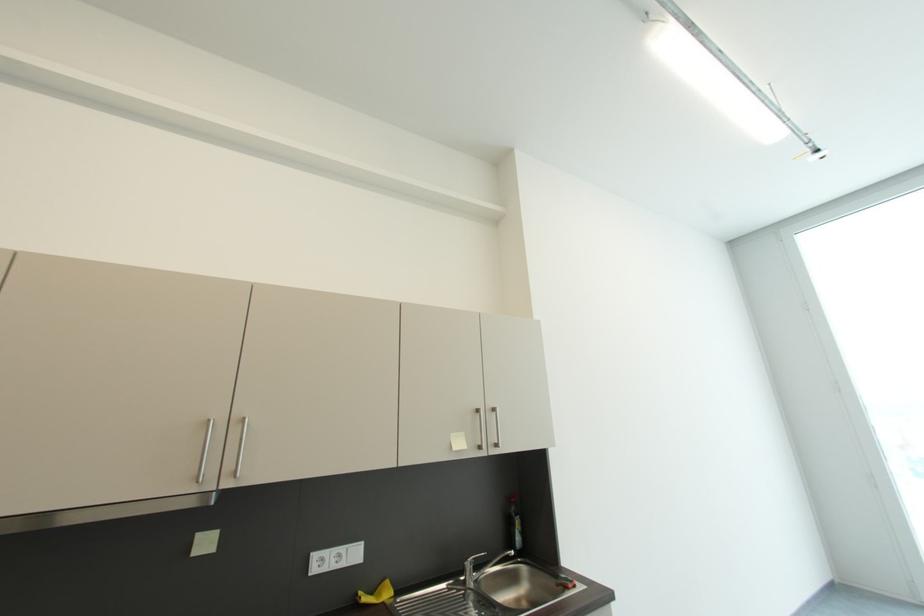
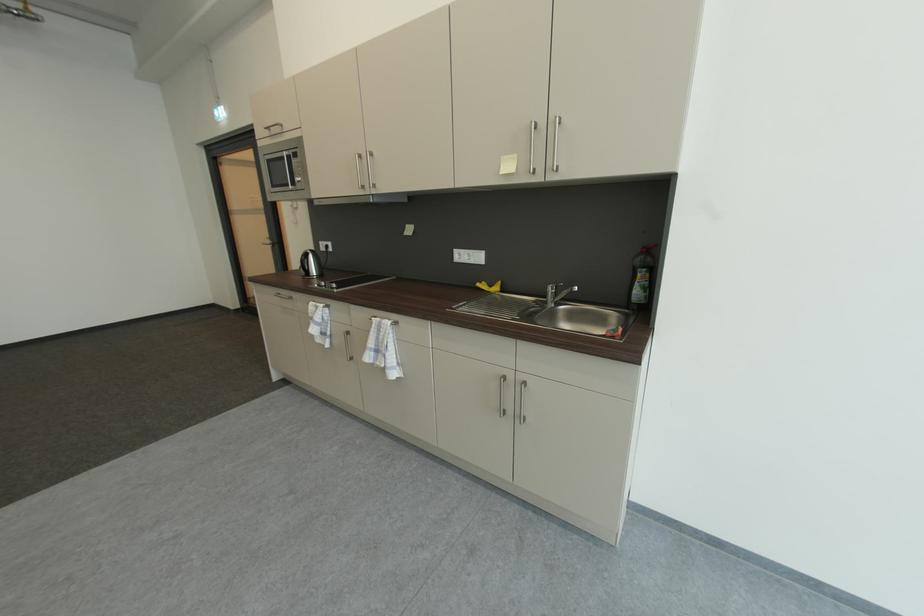
Where in the second image is the point corresponding to (x=349, y=565) from the first image?

(479, 262)